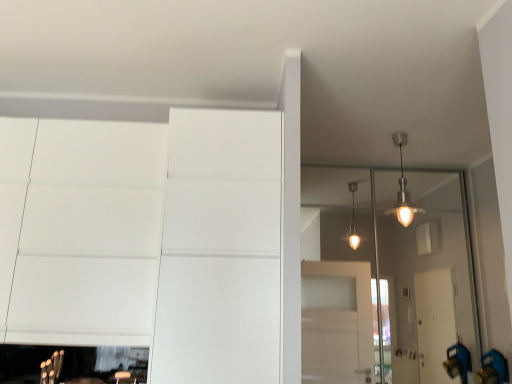
Question: Should I look upward or downward to see white matte dresser at lower left?

Choices:
 (A) down
 (B) up

Answer: (A)

Question: Can you confirm if transparent glass door at upper right is taller than white matte dresser at lower left?

Choices:
 (A) yes
 (B) no

Answer: (A)

Question: Does transparent glass door at upper right touch white matte dresser at lower left?

Choices:
 (A) no
 (B) yes

Answer: (A)

Question: Considering the relative positions of transparent glass door at upper right and white matte dresser at lower left in the image provided, is transparent glass door at upper right to the right of white matte dresser at lower left from the viewer's perspective?

Choices:
 (A) no
 (B) yes

Answer: (B)

Question: Is transparent glass door at upper right smaller than white matte dresser at lower left?

Choices:
 (A) no
 (B) yes

Answer: (B)

Question: Is transparent glass door at upper right not near white matte dresser at lower left?

Choices:
 (A) no
 (B) yes

Answer: (B)

Question: Does transparent glass door at upper right turn towards white matte dresser at lower left?

Choices:
 (A) yes
 (B) no

Answer: (B)

Question: Is white matte dresser at lower left next to transparent glass door at upper right?

Choices:
 (A) yes
 (B) no

Answer: (B)

Question: From a real-world perspective, is white matte dresser at lower left on transparent glass door at upper right?

Choices:
 (A) yes
 (B) no

Answer: (A)

Question: Is white matte dresser at lower left far away from transparent glass door at upper right?

Choices:
 (A) yes
 (B) no

Answer: (A)

Question: Is the depth of white matte dresser at lower left less than that of transparent glass door at upper right?

Choices:
 (A) no
 (B) yes

Answer: (B)

Question: From a real-world perspective, is white matte dresser at lower left positioned under transparent glass door at upper right based on gravity?

Choices:
 (A) no
 (B) yes

Answer: (A)

Question: Is white matte dresser at lower left facing away from transparent glass door at upper right?

Choices:
 (A) no
 (B) yes

Answer: (A)

Question: Considering the positions of white matte dresser at lower left and transparent glass door at upper right in the image, is white matte dresser at lower left wider or thinner than transparent glass door at upper right?

Choices:
 (A) thin
 (B) wide

Answer: (B)